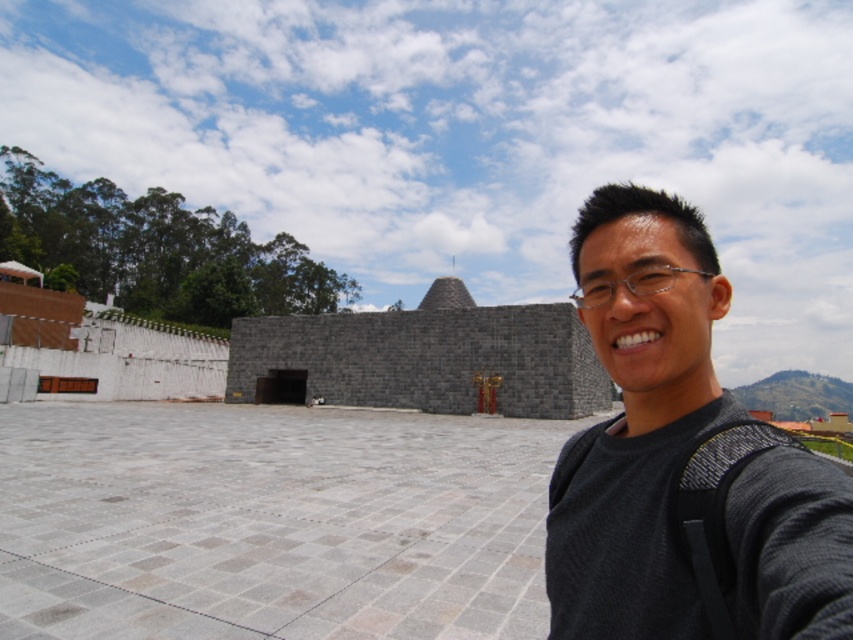
Question: Does black fabric at right appear on the right side of gray stone pyramid at center?

Choices:
 (A) no
 (B) yes

Answer: (B)

Question: Is black fabric at right positioned in front of gray stone pyramid at center?

Choices:
 (A) no
 (B) yes

Answer: (B)

Question: Can you confirm if black fabric at right is positioned to the right of gray stone pyramid at center?

Choices:
 (A) no
 (B) yes

Answer: (B)